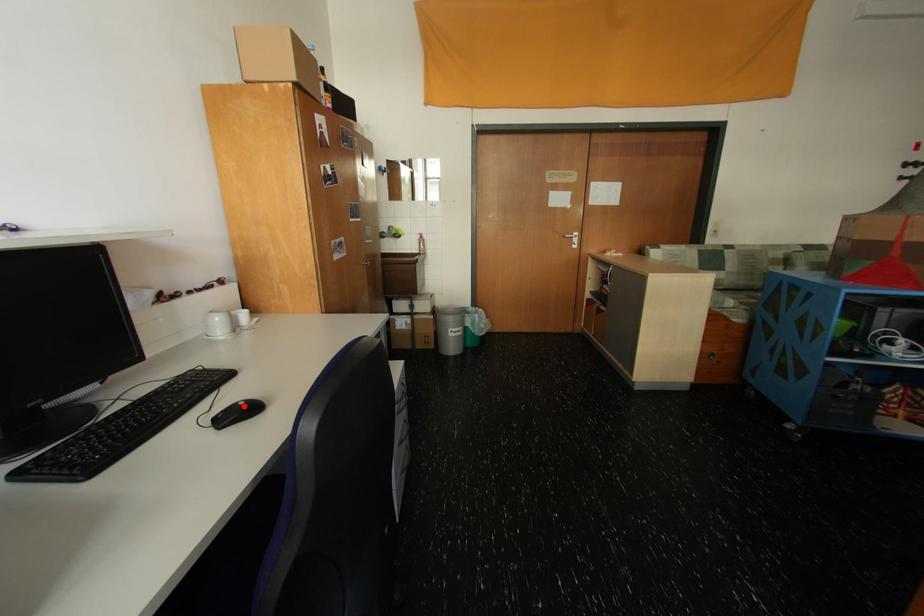
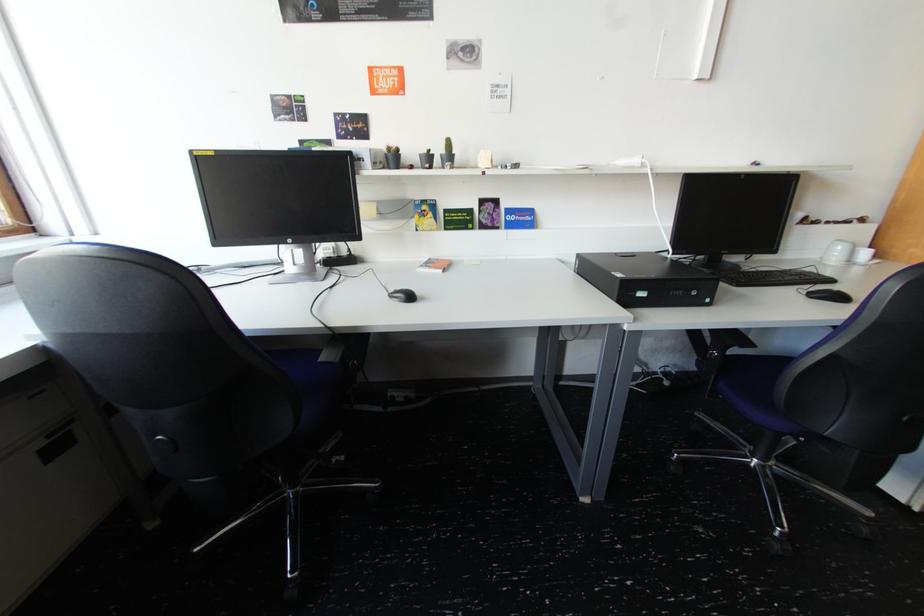
Locate, in the second image, the point that corresponds to the highlighted location in the first image.

(839, 291)